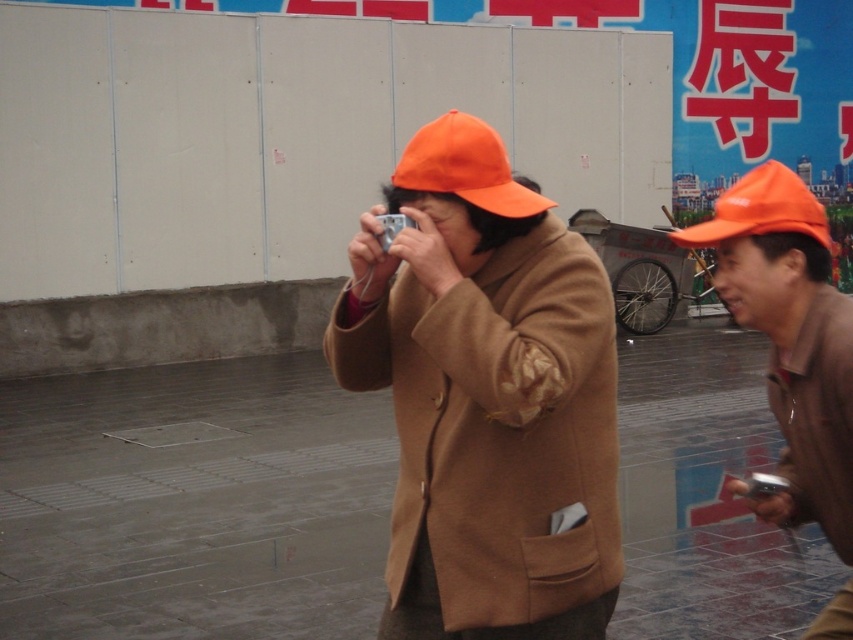
Which is more to the left, orange matte cap at center or orange fabric cap at center?

Positioned to the left is orange fabric cap at center.

This screenshot has height=640, width=853. I want to click on orange matte cap at center, so click(x=791, y=339).

What are the coordinates of `orange matte cap at center` in the screenshot? It's located at (791, 339).

Locate an element on the screen. The height and width of the screenshot is (640, 853). orange fabric cap at center is located at coordinates (465, 168).

Measure the distance between orange fabric cap at center and camera.

A distance of 2.36 meters exists between orange fabric cap at center and camera.

Describe the element at coordinates (465, 168) in the screenshot. I see `orange fabric cap at center` at that location.

You are a GUI agent. You are given a task and a screenshot of the screen. Output one action in this format:
    pyautogui.click(x=<x>, y=<y>)
    Task: Click on the orange fabric cap at center
    The width and height of the screenshot is (853, 640).
    Given the screenshot: What is the action you would take?
    pyautogui.click(x=465, y=168)

Which of these two, matte orange cap at center or orange matte cap at center, stands shorter?

With less height is orange matte cap at center.

Is the position of matte orange cap at center less distant than that of orange matte cap at center?

Yes, it is.

What are the coordinates of `matte orange cap at center` in the screenshot? It's located at (486, 397).